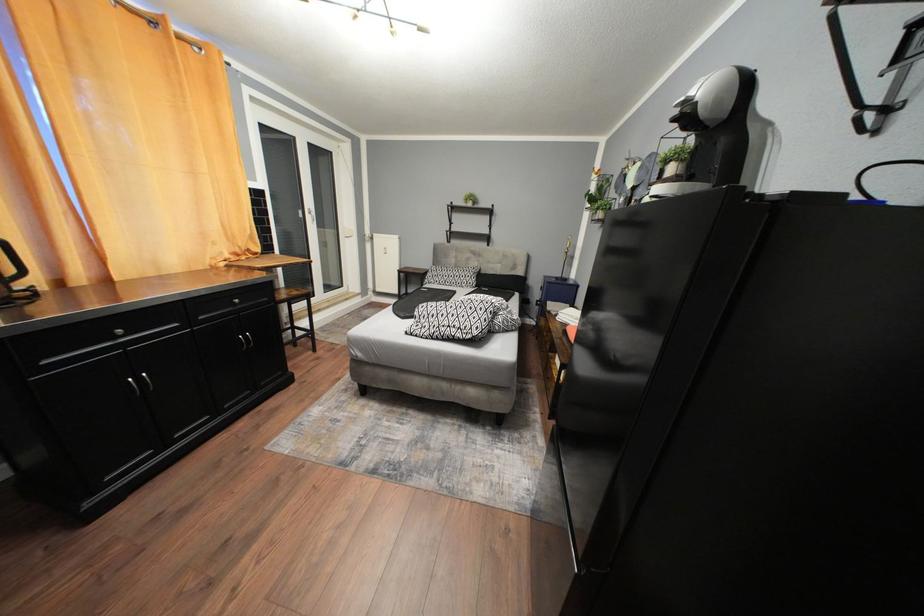
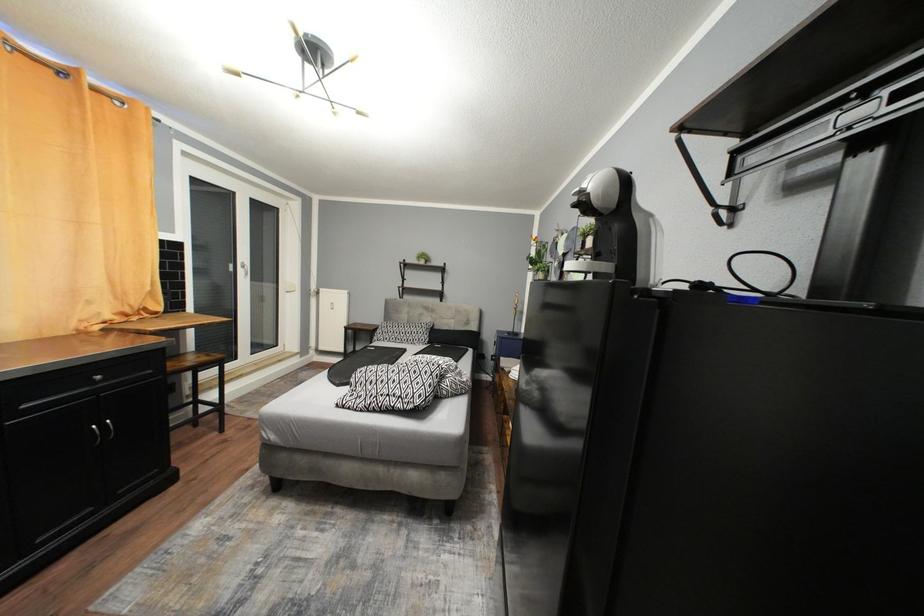
Which direction would the cameraman need to move to produce the second image?

The movement direction of the cameraman is right, forward.